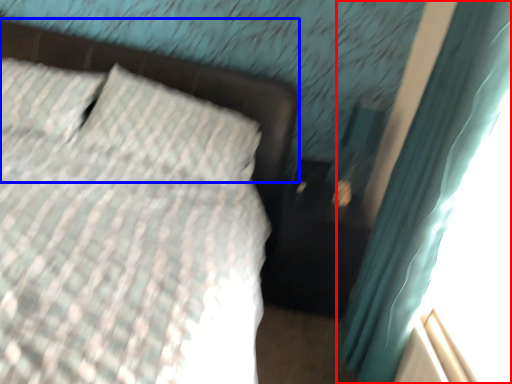
Question: Which object appears closest to the camera in this image, curtain (highlighted by a red box) or bed frame (highlighted by a blue box)?

Choices:
 (A) curtain
 (B) bed frame

Answer: (A)